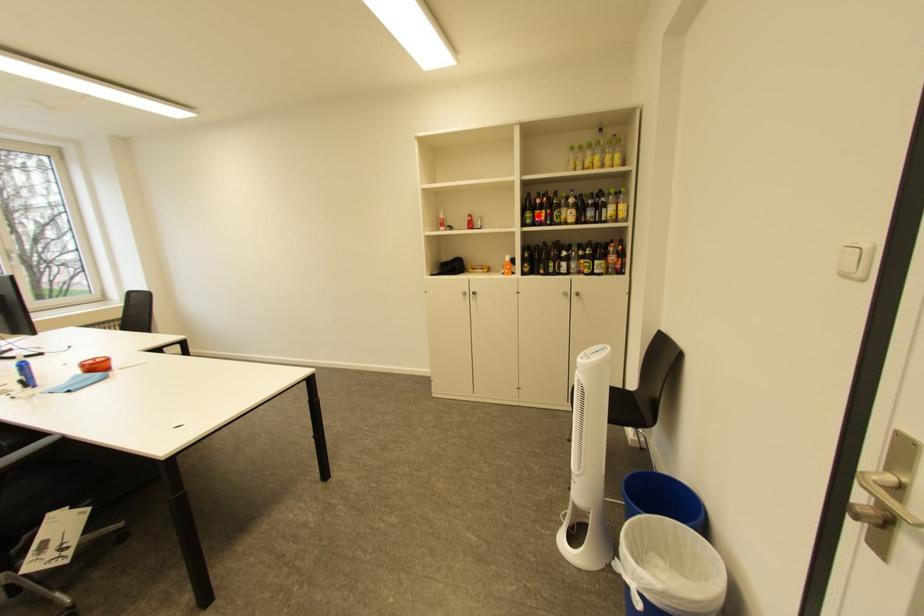
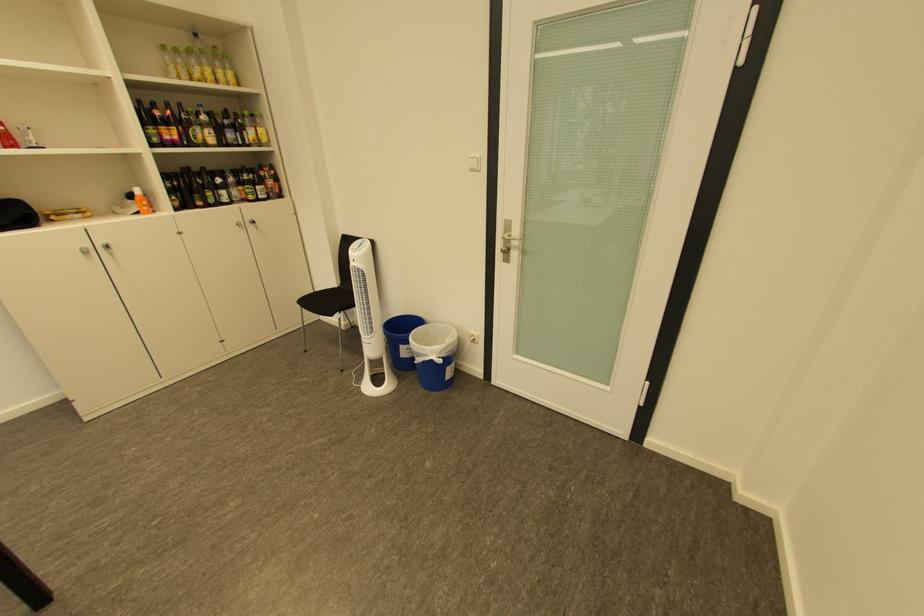
Question: I am providing you with two images of the same scene from different viewpoints. A red point is shown in image1. For the corresponding object point in image2, is it positioned nearer or farther from the camera?

Choices:
 (A) Nearer
 (B) Farther

Answer: (B)